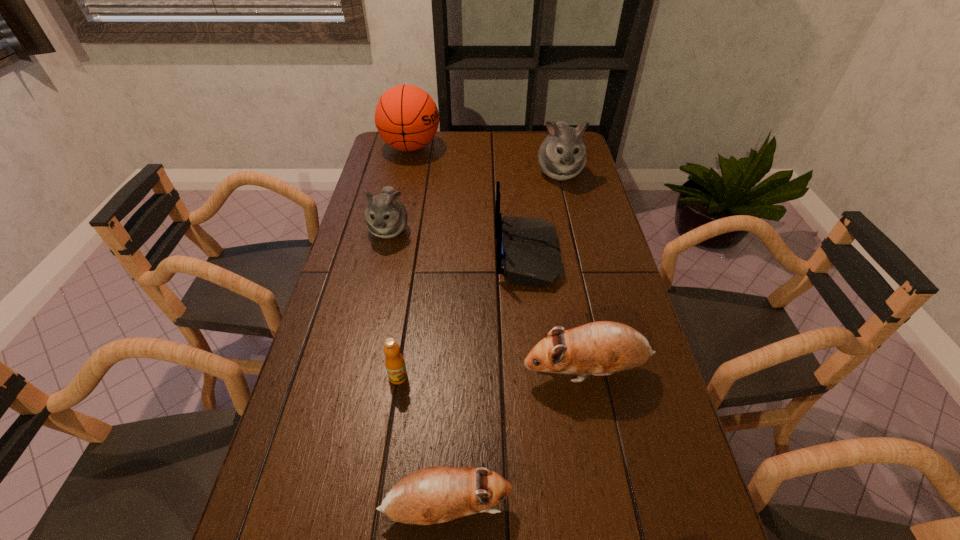
Where is `the nearest object`? the nearest object is located at coordinates (431, 495).

The width and height of the screenshot is (960, 540). Find the location of `free region located on the side with logo of the basketball`. free region located on the side with logo of the basketball is located at coordinates (494, 148).

The image size is (960, 540). Find the location of `vacant area situated on the face of the tallest hamster`. vacant area situated on the face of the tallest hamster is located at coordinates (583, 271).

The image size is (960, 540). Identify the location of vacant region located on the back of the router. (373, 255).

Locate an element on the screen. This screenshot has height=540, width=960. free space located 0.340m on the back of the router is located at coordinates (380, 255).

Identify the location of vacant space located on the back of the router. This screenshot has width=960, height=540. (451, 255).

This screenshot has height=540, width=960. In order to click on free space located 0.060m on the face of the left white hamster in this screenshot , I will do `click(381, 262)`.

Identify the location of vacant position located 0.150m at the face of the third farthest hamster. (457, 371).

Where is `free space located at the face of the third farthest hamster`? This screenshot has width=960, height=540. free space located at the face of the third farthest hamster is located at coordinates (483, 371).

At what (x,y) coordinates should I click in order to perform the action: click on vacant region located 0.080m at the face of the third farthest hamster. Please return your answer as a coordinate pair (x, y). The width and height of the screenshot is (960, 540). Looking at the image, I should click on (487, 371).